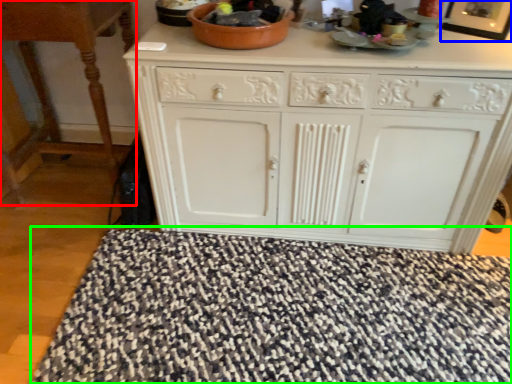
Question: Which object is positioned farthest from table (highlighted by a red box)? Select from picture frame (highlighted by a blue box) and doormat (highlighted by a green box).

Choices:
 (A) picture frame
 (B) doormat

Answer: (A)